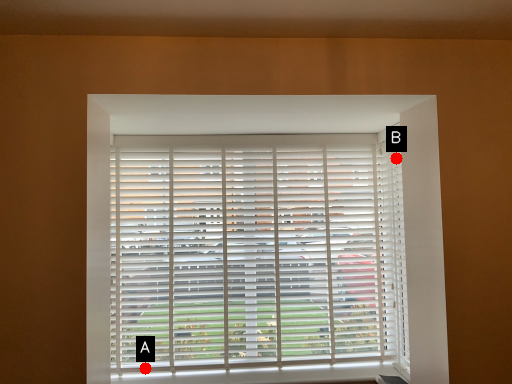
Question: Two points are circled on the image, labeled by A and B beside each circle. Among these points, which one is farthest from the camera?

Choices:
 (A) A is further
 (B) B is further

Answer: (B)